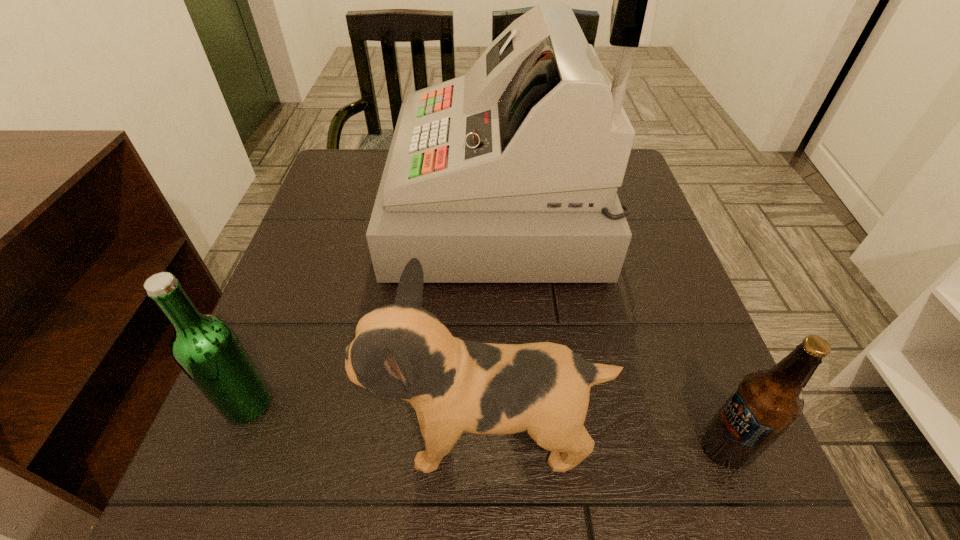
Where is `beer bottle that is positioned at the right edge`? This screenshot has height=540, width=960. beer bottle that is positioned at the right edge is located at coordinates (766, 403).

Locate an element on the screen. The image size is (960, 540). object that is at the far right corner is located at coordinates (508, 174).

This screenshot has height=540, width=960. In order to click on object positioned at the near right corner in this screenshot , I will do `click(766, 403)`.

This screenshot has width=960, height=540. Identify the location of vacant space at the near edge of the desktop. (527, 481).

Image resolution: width=960 pixels, height=540 pixels. Find the location of `blank space at the left edge of the desktop`. blank space at the left edge of the desktop is located at coordinates (331, 272).

Where is `vacant area at the right edge of the desktop`? vacant area at the right edge of the desktop is located at coordinates (633, 205).

Identify the location of free space at the far right corner. (645, 199).

Find the location of a particular element. free space between the left beer bottle and the farthest object is located at coordinates (373, 306).

The width and height of the screenshot is (960, 540). I want to click on unoccupied area between the rightmost object and the cash register, so click(x=612, y=328).

The width and height of the screenshot is (960, 540). I want to click on vacant area that lies between the farthest object and the puppy, so click(492, 321).